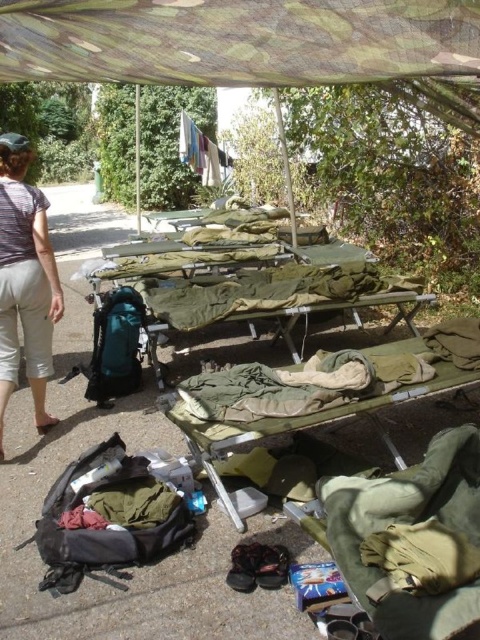
Question: Can you confirm if camouflage fabric canopy at upper center is positioned to the right of light gray cotton pants at left?

Choices:
 (A) no
 (B) yes

Answer: (B)

Question: In this image, where is camouflage fabric canopy at upper center located relative to camouflage fabric cot at center?

Choices:
 (A) right
 (B) left

Answer: (B)

Question: Can you confirm if camouflage fabric cot at center is thinner than light gray cotton pants at left?

Choices:
 (A) no
 (B) yes

Answer: (A)

Question: Which of these objects is positioned closest to the camouflage fabric canopy at upper center?

Choices:
 (A) light gray cotton pants at left
 (B) camouflage fabric cot at center

Answer: (A)

Question: Which object is positioned farthest from the light gray cotton pants at left?

Choices:
 (A) camouflage fabric canopy at upper center
 (B) camouflage fabric cot at center

Answer: (B)

Question: Which of the following is the farthest from the observer?

Choices:
 (A) light gray cotton pants at left
 (B) camouflage fabric canopy at upper center
 (C) camouflage fabric cot at center

Answer: (A)